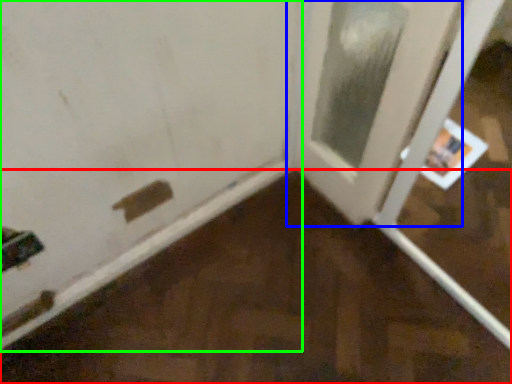
Question: Based on their relative distances, which object is farther from plywood (highlighted by a red box)? Choose from door (highlighted by a blue box) and door (highlighted by a green box).

Choices:
 (A) door
 (B) door

Answer: (A)